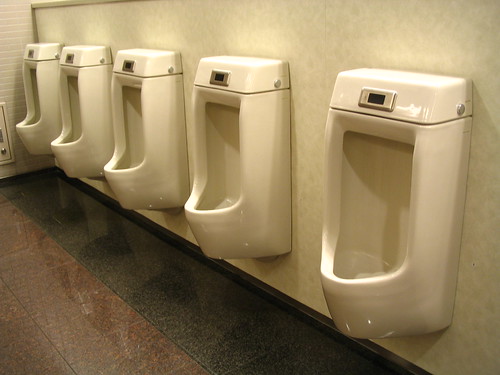
The width and height of the screenshot is (500, 375). I want to click on urinal, so click(x=34, y=82), click(x=81, y=101), click(x=142, y=122), click(x=212, y=140), click(x=367, y=185).